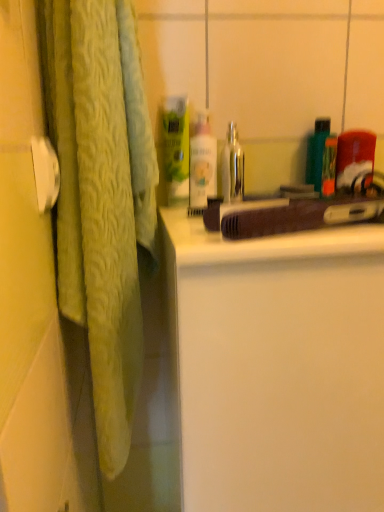
Question: From a real-world perspective, is brown matte hairdryer at center positioned above or below white matte cabinet at center?

Choices:
 (A) above
 (B) below

Answer: (A)

Question: Is point (228, 247) positioned closer to the camera than point (367, 296)?

Choices:
 (A) closer
 (B) farther

Answer: (A)

Question: Which is farther from the brown matte hairdryer at center?

Choices:
 (A) shiny metallic faucet at center
 (B) white matte cabinet at center
 (C) white glossy lotion at center
 (D) green matte bottle at center

Answer: (A)

Question: Estimate the real-world distances between objects in this image. Which object is farther from the shiny metallic faucet at center?

Choices:
 (A) white glossy lotion at center
 (B) white matte cabinet at center
 (C) green matte bottle at center
 (D) brown matte hairdryer at center

Answer: (B)